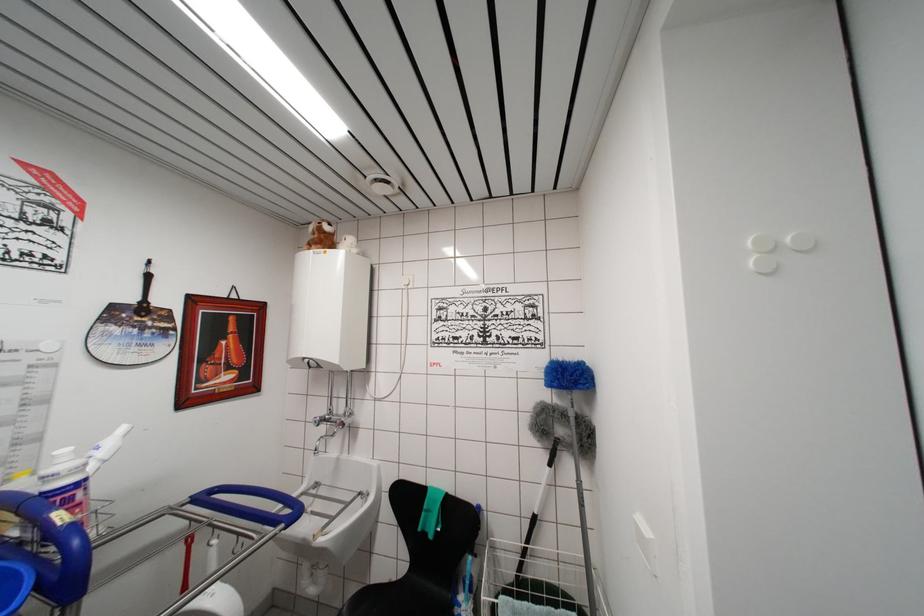
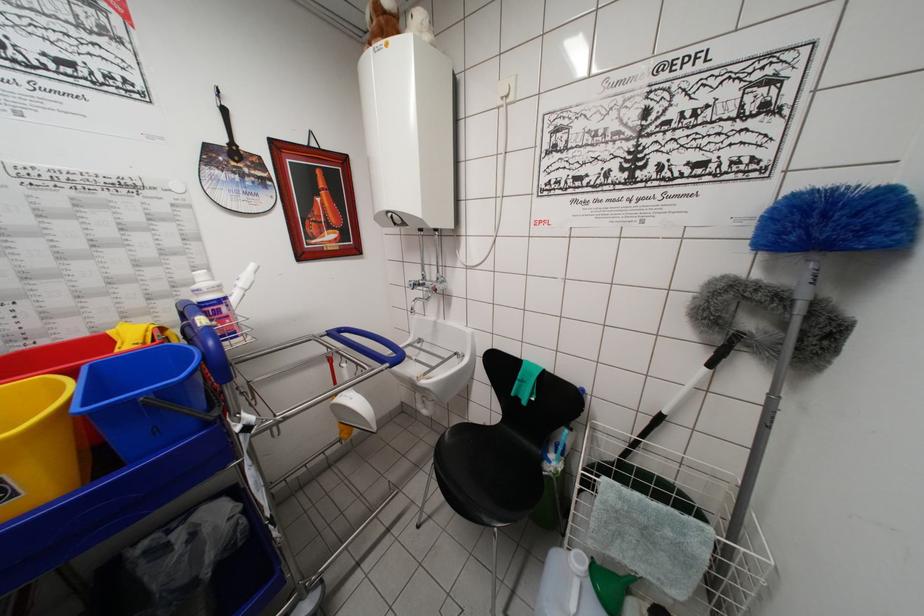
Question: I am providing you with two images of the same scene from different viewpoints. Please identify which objects are invisible in image2.

Choices:
 (A) black chair sitting surface
 (B) green funnel
 (C) blue cart handle
 (D) none of these

Answer: (D)